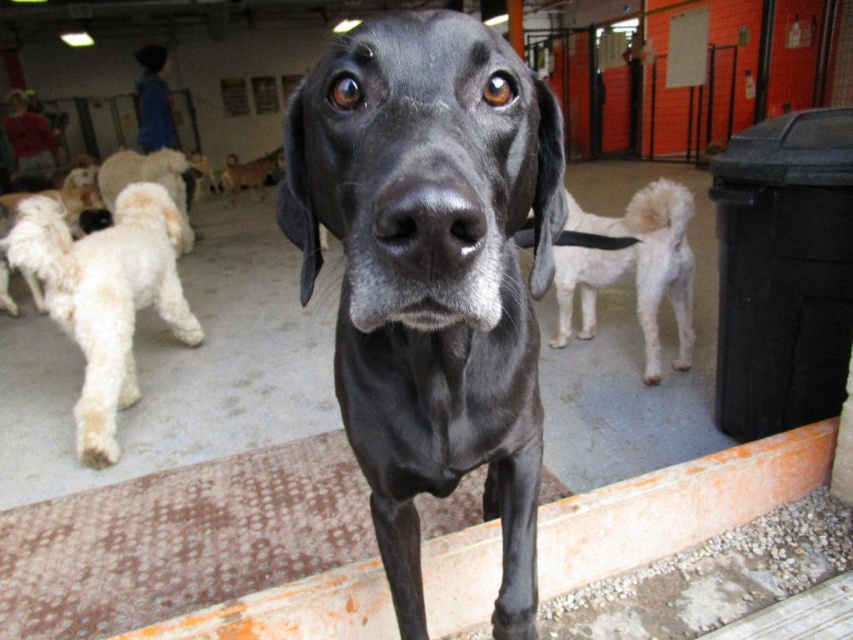
This screenshot has width=853, height=640. What do you see at coordinates (105, 296) in the screenshot? I see `white fluffy dog at left` at bounding box center [105, 296].

Is point (129, 292) more distant than point (572, 272)?

No, it is in front of (572, 272).

Find the location of a particular element. Image resolution: width=853 pixels, height=640 pixels. white fluffy dog at left is located at coordinates (105, 296).

Is black glossy dog at center smaller than white fluffy dog at left?

Yes.

Is point (509, 465) positioned in front of point (106, 284)?

Yes, it is.

Describe the element at coordinates (432, 275) in the screenshot. I see `black glossy dog at center` at that location.

The width and height of the screenshot is (853, 640). I want to click on black glossy dog at center, so click(432, 275).

Can you confirm if black glossy dog at center is positioned to the left of white fluffy dog at center?

Correct, you'll find black glossy dog at center to the left of white fluffy dog at center.

Which is in front, point (514, 76) or point (556, 346)?

Point (514, 76)

Which is behind, point (364, 272) or point (683, 259)?

Point (683, 259)

Find the location of `black glossy dog at center`. black glossy dog at center is located at coordinates pos(432,275).